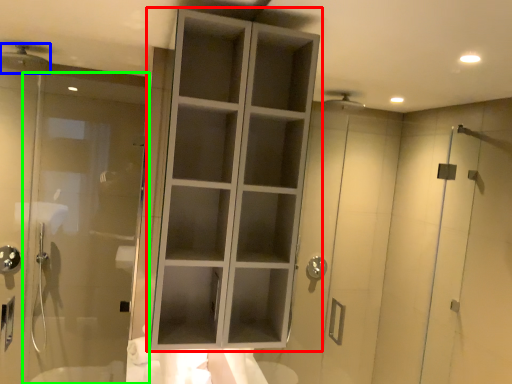
Question: Which object is the closest to the cupboard (highlighted by a red box)? Choose among these: shower (highlighted by a blue box) or door (highlighted by a green box).

Choices:
 (A) shower
 (B) door

Answer: (B)